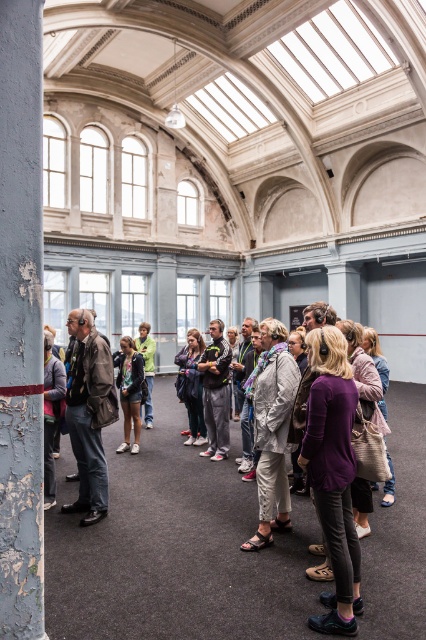
Question: Which object is closer to the camera taking this photo?

Choices:
 (A) green denim jacket at center
 (B) denim shorts at center

Answer: (B)

Question: Is purple fabric bag at center positioned in front of green denim jacket at center?

Choices:
 (A) yes
 (B) no

Answer: (A)

Question: Among these objects, which one is farthest from the camera?

Choices:
 (A) green denim jacket at center
 (B) purple fabric bag at center

Answer: (A)

Question: Which point is farther to the camera?

Choices:
 (A) (264, 424)
 (B) (126, 380)

Answer: (B)

Question: Is peeling paint column at left above dark gray sweatpants at center?

Choices:
 (A) no
 (B) yes

Answer: (B)

Question: Does dark gray sweatpants at center appear on the right side of dark gray jacket at left?

Choices:
 (A) no
 (B) yes

Answer: (B)